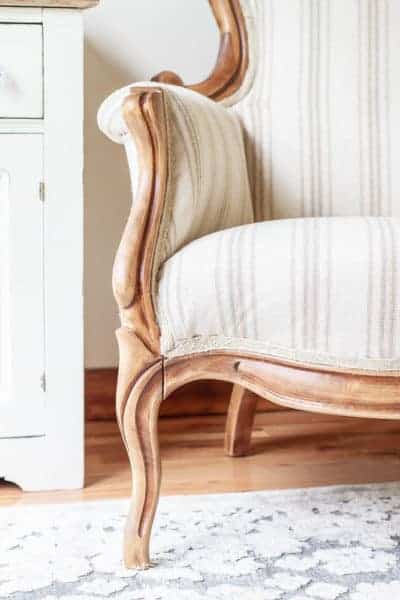
Where is `wooden floor`? wooden floor is located at coordinates (288, 444).